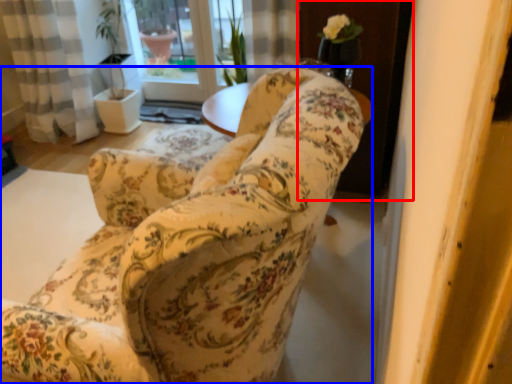
Question: Which point is closer to the camera, screen door (highlighted by a red box) or chair (highlighted by a blue box)?

Choices:
 (A) screen door
 (B) chair

Answer: (B)